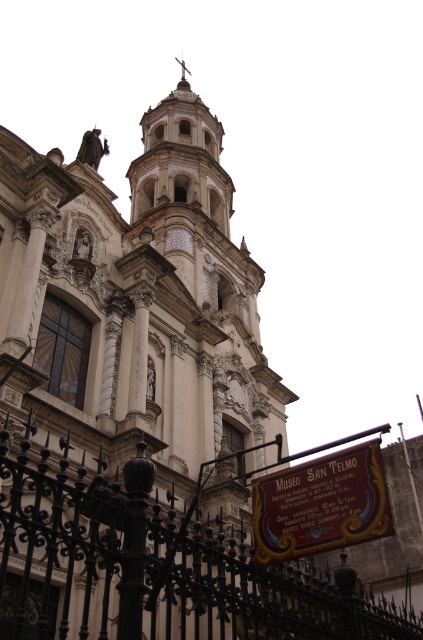
Question: Among these objects, which one is farthest from the camera?

Choices:
 (A) wooden signboard at center
 (B) black wrought iron fence at lower center

Answer: (A)

Question: Does black wrought iron fence at lower center have a lesser width compared to wooden signboard at center?

Choices:
 (A) no
 (B) yes

Answer: (A)

Question: Which of the following is the farthest from the observer?

Choices:
 (A) wooden signboard at center
 (B) black wrought iron fence at lower center

Answer: (A)

Question: In this image, where is black wrought iron fence at lower center located relative to wooden signboard at center?

Choices:
 (A) right
 (B) left

Answer: (B)

Question: Is black wrought iron fence at lower center in front of wooden signboard at center?

Choices:
 (A) no
 (B) yes

Answer: (B)